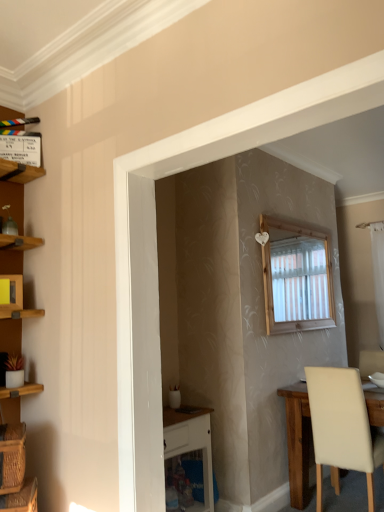
In order to face beige leather chair at lower right, should I rotate leftwards or rightwards?

Turn right by 20.417 degrees to look at beige leather chair at lower right.

The width and height of the screenshot is (384, 512). I want to click on beige leather chair at lower right, so click(x=342, y=428).

Describe the element at coordinates (12, 457) in the screenshot. The width and height of the screenshot is (384, 512). I see `woven brown basket at lower left, acting as the 2th basket starting from the bottom` at that location.

The height and width of the screenshot is (512, 384). Describe the element at coordinates (11, 296) in the screenshot. I see `yellow matte cabinet at upper left, which appears as the second cabinet when viewed from the top` at that location.

The height and width of the screenshot is (512, 384). I want to click on white glossy vanity at lower center, so click(189, 454).

Locate an element on the screen. This screenshot has height=512, width=384. wooden clapperboard at upper left, which ranks as the 2th cabinet in bottom-to-top order is located at coordinates (19, 170).

What is the approximate height of wooden clapperboard at upper left, which ranks as the 2th cabinet in bottom-to-top order?

wooden clapperboard at upper left, which ranks as the 2th cabinet in bottom-to-top order, is 14.29 inches tall.

Identify the location of woven brown basket at lower left, the first basket positioned from the bottom. Image resolution: width=384 pixels, height=512 pixels. (21, 498).

The width and height of the screenshot is (384, 512). I want to click on beige leather chair at lower right, so click(x=342, y=428).

Is beige leather chair at lower right spatially inside wooden clapperboard at upper left, which ranks as the 2th cabinet in bottom-to-top order, or outside of it?

beige leather chair at lower right exists outside the volume of wooden clapperboard at upper left, which ranks as the 2th cabinet in bottom-to-top order.

Looking at the image, does beige leather chair at lower right seem bigger or smaller compared to wooden clapperboard at upper left, the first cabinet when ordered from top to bottom?

Considering their sizes, beige leather chair at lower right takes up more space than wooden clapperboard at upper left, the first cabinet when ordered from top to bottom.

Considering the points (339, 379) and (34, 168), which point is in front, point (339, 379) or point (34, 168)?

Point (34, 168)

Who is smaller, beige leather chair at lower right or white sheer curtain at right?

Answer: With smaller size is white sheer curtain at right.

Is beige leather chair at lower right not inside white sheer curtain at right?

Yes, beige leather chair at lower right is not within white sheer curtain at right.

What's the angular difference between beige leather chair at lower right and white sheer curtain at right's facing directions?

They differ by 180 degrees in their facing directions.

Which object is positioned more to the right, wooden clapperboard at upper left, the 1th cabinet viewed from the back, or beige leather chair at lower right?

From the viewer's perspective, beige leather chair at lower right appears more on the right side.

Is point (6, 164) farther from camera compared to point (382, 455)?

That is False.

Is wooden clapperboard at upper left, the first cabinet when ordered from top to bottom, touching beige leather chair at lower right?

No, wooden clapperboard at upper left, the first cabinet when ordered from top to bottom, is not in contact with beige leather chair at lower right.

Can you confirm if woven brown basket at lower left, the first basket positioned from the bottom, is bigger than beige leather chair at lower right?

Incorrect, woven brown basket at lower left, the first basket positioned from the bottom, is not larger than beige leather chair at lower right.

Identify the location of the 1st basket to the left of the beige leather chair at lower right, starting your count from the anchor. This screenshot has width=384, height=512. (21, 498).

Considering the relative positions of woven brown basket at lower left, the first basket positioned from the bottom, and beige leather chair at lower right in the image provided, is woven brown basket at lower left, the first basket positioned from the bottom, in front of beige leather chair at lower right?

Yes, woven brown basket at lower left, the first basket positioned from the bottom, is closer to the camera.

Is woven brown basket at lower left, the first basket positioned from the bottom, beside beige leather chair at lower right?

No, woven brown basket at lower left, the first basket positioned from the bottom, is not touching beige leather chair at lower right.

How many degrees apart are the facing directions of woven brown basket at lower left, the first basket positioned from the bottom, and woven brown basket at lower left, the 1th basket in the top-to-bottom sequence?

The facing directions of woven brown basket at lower left, the first basket positioned from the bottom, and woven brown basket at lower left, the 1th basket in the top-to-bottom sequence, are 4.59 degrees apart.

Does woven brown basket at lower left, the second basket positioned from the top, have a greater width compared to woven brown basket at lower left, the 1th basket in the top-to-bottom sequence?

Correct, the width of woven brown basket at lower left, the second basket positioned from the top, exceeds that of woven brown basket at lower left, the 1th basket in the top-to-bottom sequence.

How much distance is there between woven brown basket at lower left, the first basket positioned from the bottom, and woven brown basket at lower left, acting as the 2th basket starting from the bottom?

They are 11.55 centimeters apart.

Does woven brown basket at lower left, the first basket positioned from the bottom, appear on the right side of woven brown basket at lower left, acting as the 2th basket starting from the bottom?

Yes.

Would you say yellow matte cabinet at upper left, positioned as the first cabinet in bottom-to-top order, is inside or outside woven brown basket at lower left, the second basket positioned from the top?

yellow matte cabinet at upper left, positioned as the first cabinet in bottom-to-top order, exists outside the volume of woven brown basket at lower left, the second basket positioned from the top.

Considering the positions of objects yellow matte cabinet at upper left, positioned as the first cabinet in bottom-to-top order, and woven brown basket at lower left, the second basket positioned from the top, in the image provided, who is behind, yellow matte cabinet at upper left, positioned as the first cabinet in bottom-to-top order, or woven brown basket at lower left, the second basket positioned from the top,?

yellow matte cabinet at upper left, positioned as the first cabinet in bottom-to-top order, is more distant.

Are yellow matte cabinet at upper left, which appears as the second cabinet when viewed from the top, and woven brown basket at lower left, the second basket positioned from the top, far apart?

That's not correct — yellow matte cabinet at upper left, which appears as the second cabinet when viewed from the top, is a little close to woven brown basket at lower left, the second basket positioned from the top.

Between yellow matte cabinet at upper left, arranged as the 1th cabinet when viewed from the front, and woven brown basket at lower left, the second basket positioned from the top, which one appears on the left side from the viewer's perspective?

From the viewer's perspective, yellow matte cabinet at upper left, arranged as the 1th cabinet when viewed from the front, appears more on the left side.

Does point (380, 246) come behind point (10, 166)?

That is True.

Considering the relative sizes of white sheer curtain at right and wooden clapperboard at upper left, the first cabinet when ordered from top to bottom, in the image provided, is white sheer curtain at right thinner than wooden clapperboard at upper left, the first cabinet when ordered from top to bottom,?

No, white sheer curtain at right is not thinner than wooden clapperboard at upper left, the first cabinet when ordered from top to bottom.

Is white sheer curtain at right positioned far away from wooden clapperboard at upper left, which ranks as the 2th cabinet in bottom-to-top order?

That's right, there is a large distance between white sheer curtain at right and wooden clapperboard at upper left, which ranks as the 2th cabinet in bottom-to-top order.

From the image's perspective, is white sheer curtain at right below wooden clapperboard at upper left, which appears as the second cabinet when viewed from the front?

Yes, from the image's perspective, white sheer curtain at right is beneath wooden clapperboard at upper left, which appears as the second cabinet when viewed from the front.

Find the location of a particular element. chair below the wooden clapperboard at upper left, the 1th cabinet viewed from the back (from a real-world perspective) is located at coordinates (342, 428).

Find the location of a particular element. This screenshot has height=512, width=384. chair below the white sheer curtain at right (from the image's perspective) is located at coordinates (342, 428).

From the picture: Which object lies further to the anchor point woven brown basket at lower left, the 1th basket in the top-to-bottom sequence, white glossy vanity at lower center or yellow matte cabinet at upper left, which appears as the second cabinet when viewed from the top?

The object further to woven brown basket at lower left, the 1th basket in the top-to-bottom sequence, is white glossy vanity at lower center.

Looking at the image, which one is located further to yellow matte cabinet at upper left, positioned as the first cabinet in bottom-to-top order, white glossy vanity at lower center or white sheer curtain at right?

white sheer curtain at right lies further to yellow matte cabinet at upper left, positioned as the first cabinet in bottom-to-top order, than the other object.

From the image, which object appears to be farther from wooden clapperboard at upper left, which appears as the second cabinet when viewed from the front, woven brown basket at lower left, the first basket positioned from the bottom, or white sheer curtain at right?

white sheer curtain at right.

Based on their spatial positions, is yellow matte cabinet at upper left, which appears as the second cabinet when viewed from the top, or white sheer curtain at right further from white glossy vanity at lower center?

white sheer curtain at right is further to white glossy vanity at lower center.

Estimate the real-world distances between objects in this image. Which object is further from yellow matte cabinet at upper left, arranged as the second cabinet when viewed from the back, white glossy vanity at lower center or beige leather chair at lower right?

Based on the image, beige leather chair at lower right appears to be further to yellow matte cabinet at upper left, arranged as the second cabinet when viewed from the back.

Based on their spatial positions, is woven brown basket at lower left, the second basket positioned from the top, or yellow matte cabinet at upper left, which appears as the second cabinet when viewed from the top, further from white glossy vanity at lower center?

Based on the image, yellow matte cabinet at upper left, which appears as the second cabinet when viewed from the top, appears to be further to white glossy vanity at lower center.

From the image, which object appears to be nearer to yellow matte cabinet at upper left, which appears as the second cabinet when viewed from the top, woven brown basket at lower left, the 1th basket in the top-to-bottom sequence, or wooden clapperboard at upper left, the 1th cabinet viewed from the back?

The object closer to yellow matte cabinet at upper left, which appears as the second cabinet when viewed from the top, is wooden clapperboard at upper left, the 1th cabinet viewed from the back.

Looking at the image, which one is located closer to woven brown basket at lower left, the first basket positioned from the bottom, woven brown basket at lower left, the 1th basket in the top-to-bottom sequence, or yellow matte cabinet at upper left, positioned as the first cabinet in bottom-to-top order?

The object closer to woven brown basket at lower left, the first basket positioned from the bottom, is woven brown basket at lower left, the 1th basket in the top-to-bottom sequence.

Image resolution: width=384 pixels, height=512 pixels. I want to click on basket between yellow matte cabinet at upper left, arranged as the second cabinet when viewed from the back, and woven brown basket at lower left, the first basket positioned from the bottom, in the vertical direction, so click(x=12, y=457).

Locate an element on the screen. cabinet between wooden clapperboard at upper left, the first cabinet when ordered from top to bottom, and woven brown basket at lower left, the second basket positioned from the top, in the up-down direction is located at coordinates (11, 296).

This screenshot has width=384, height=512. I want to click on chair between woven brown basket at lower left, the 1th basket in the top-to-bottom sequence, and white sheer curtain at right in the front-back direction, so click(x=342, y=428).

You are a GUI agent. You are given a task and a screenshot of the screen. Output one action in this format:
    pyautogui.click(x=<x>, y=<y>)
    Task: Click on the chair between woven brown basket at lower left, the second basket positioned from the top, and white sheer curtain at right, along the z-axis
    This screenshot has width=384, height=512.
    Given the screenshot: What is the action you would take?
    pyautogui.click(x=342, y=428)